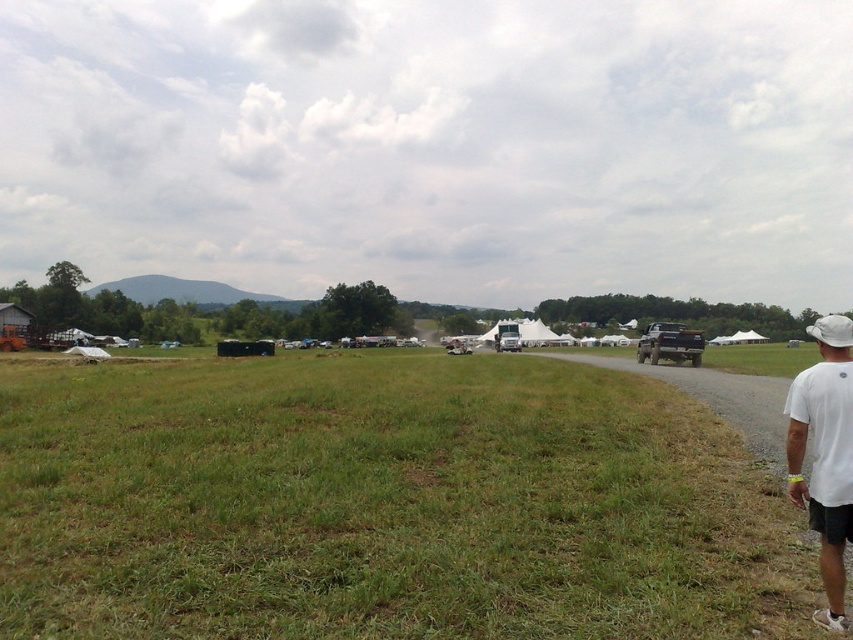
Question: Which point is farther to the camera?

Choices:
 (A) (138, 628)
 (B) (811, 326)
 (C) (666, 336)

Answer: (C)

Question: Among these points, which one is nearest to the camera?

Choices:
 (A) coord(585,419)
 (B) coord(848,326)

Answer: (B)

Question: Considering the relative positions of white t-shirt at right and matte black truck at right in the image provided, where is white t-shirt at right located with respect to matte black truck at right?

Choices:
 (A) above
 (B) below

Answer: (B)

Question: Which object appears farthest from the camera in this image?

Choices:
 (A) white t-shirt at right
 (B) matte black truck at right
 (C) white fabric baseball hat at right

Answer: (B)

Question: Can you confirm if green grass at center is positioned to the right of white t-shirt at right?

Choices:
 (A) no
 (B) yes

Answer: (A)

Question: Is white t-shirt at right closer to camera compared to matte black truck at right?

Choices:
 (A) yes
 (B) no

Answer: (A)